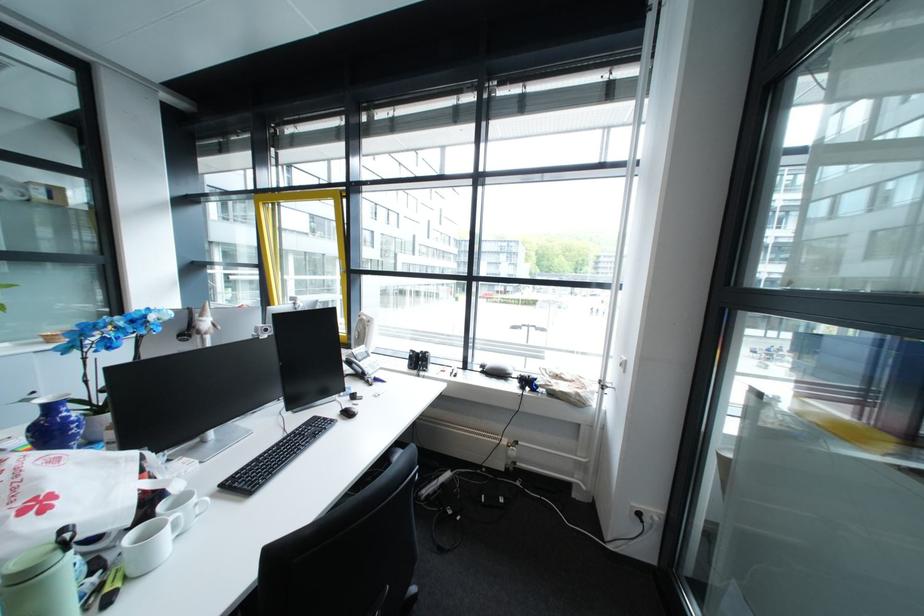
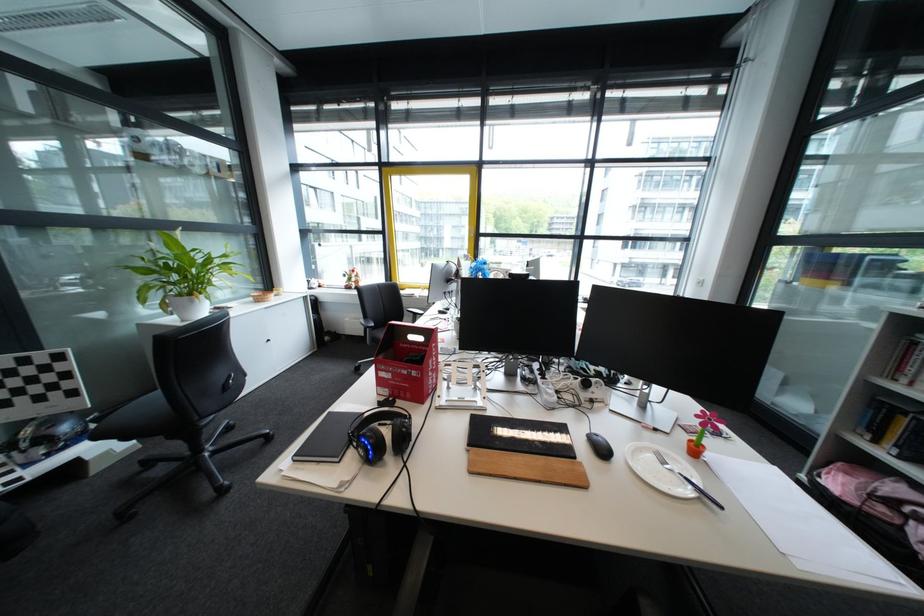
What movement of the cameraman would produce the second image?

The cameraman walked toward left, backward.